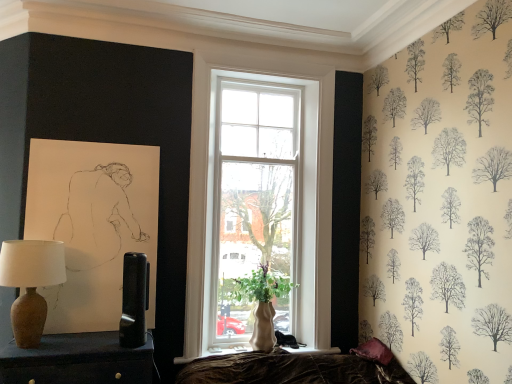
I want to click on vacant space positioned to the left of matte black table lamp at center, the second table lamp from the left, so click(x=101, y=350).